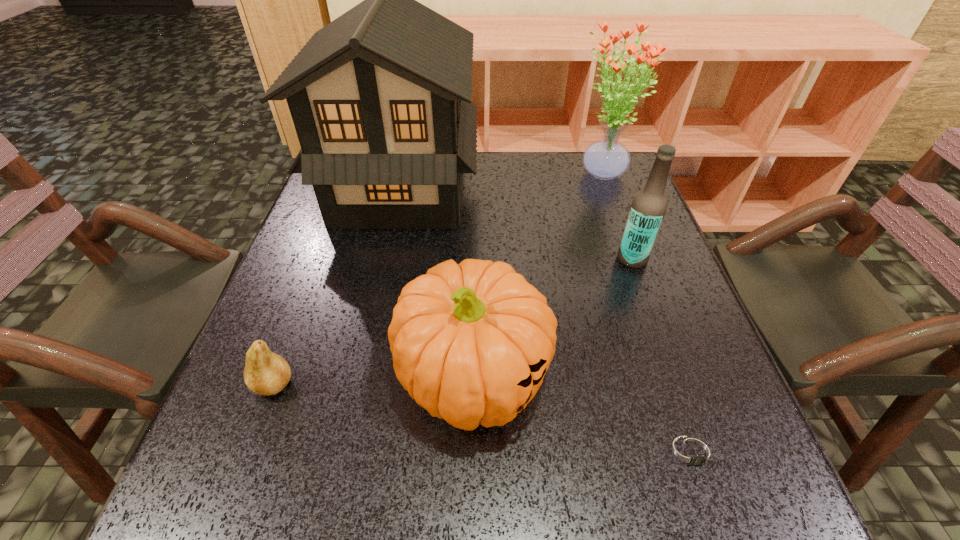
The image size is (960, 540). I want to click on free space that is in between the second tallest object and the fourth nearest object, so click(x=616, y=217).

Where is `free spot between the dollhouse and the third farthest object`? The height and width of the screenshot is (540, 960). free spot between the dollhouse and the third farthest object is located at coordinates (516, 225).

You are a GUI agent. You are given a task and a screenshot of the screen. Output one action in this format:
    pyautogui.click(x=<x>, y=<y>)
    Task: Click on the vacant space that is in between the pear and the dollhouse
    
    Given the screenshot: What is the action you would take?
    pyautogui.click(x=337, y=287)

You are a GUI agent. You are given a task and a screenshot of the screen. Output one action in this format:
    pyautogui.click(x=<x>, y=<y>)
    Task: Click on the object identified as the second closest to the flower arrangement
    
    Given the screenshot: What is the action you would take?
    pyautogui.click(x=380, y=98)

Locate an element on the screen. the second closest object to the beer bottle is located at coordinates (471, 342).

Image resolution: width=960 pixels, height=540 pixels. Find the location of `free spot that satisfies the following two spatial constraints: 1. on the label of the beer bottle; 2. on the front side of the fifth tallest object`. free spot that satisfies the following two spatial constraints: 1. on the label of the beer bottle; 2. on the front side of the fifth tallest object is located at coordinates (678, 384).

Identify the location of vacant area in the image that satisfies the following two spatial constraints: 1. on the label of the third farthest object; 2. on the face of the shortest object. The image size is (960, 540). (702, 453).

This screenshot has height=540, width=960. I want to click on vacant space that satisfies the following two spatial constraints: 1. on the label of the third farthest object; 2. on the surface of the pumpkin, so click(x=675, y=377).

This screenshot has width=960, height=540. What are the coordinates of `vacant space that satisfies the following two spatial constraints: 1. on the label of the beer bottle; 2. on the face of the watch` in the screenshot? It's located at click(x=702, y=453).